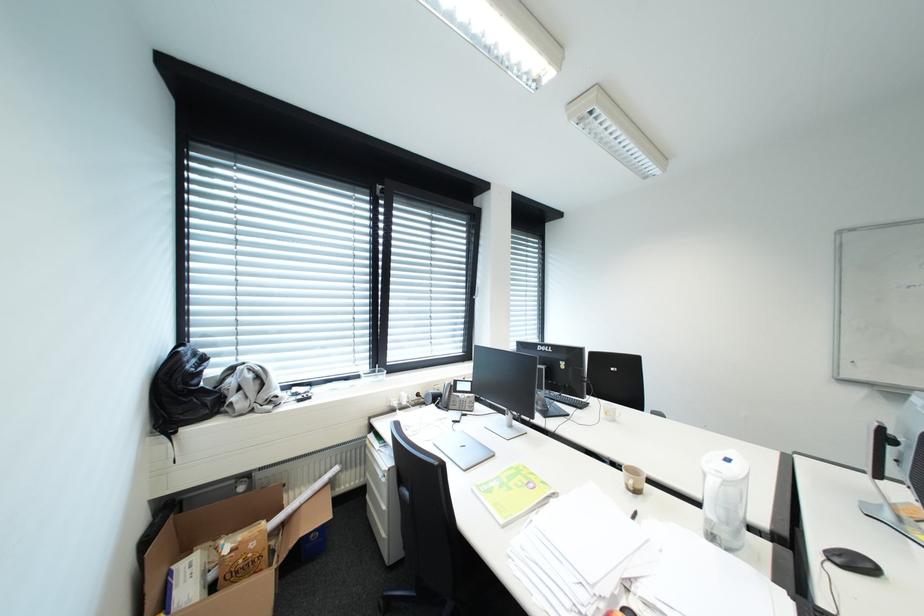
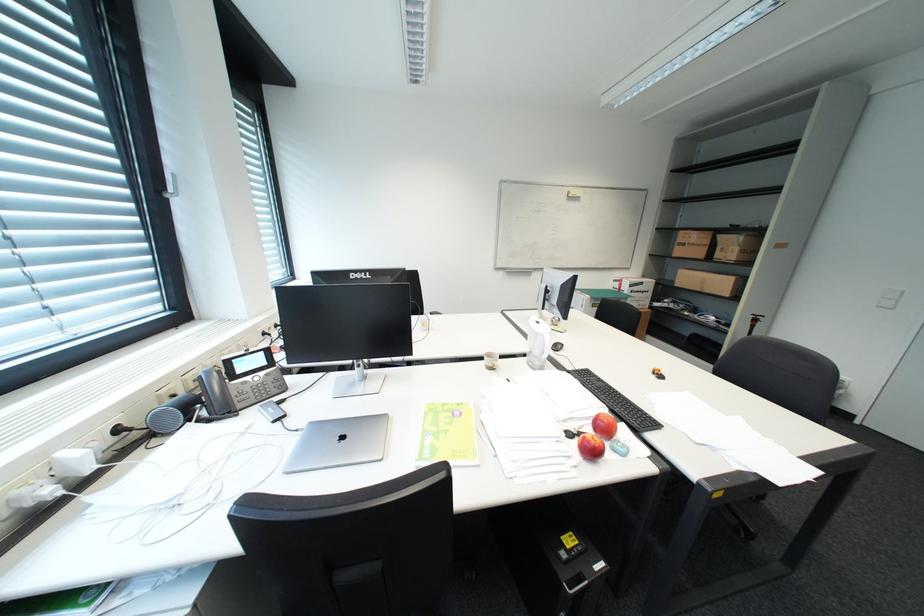
The first image is from the beginning of the video and the second image is from the end. How did the camera likely rotate when shooting the video?

The camera rotated toward right-down.